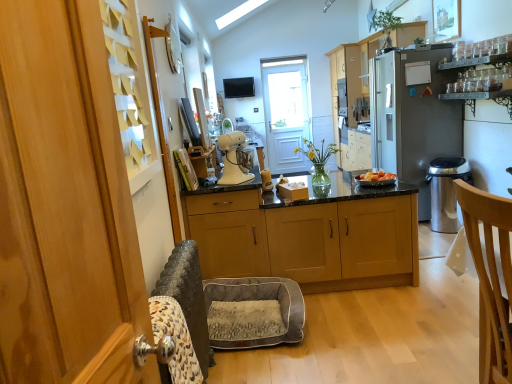
This screenshot has height=384, width=512. I want to click on light wood cabinets at center, the second cabinetry ordered from the bottom, so click(x=350, y=105).

Identify the location of green leafy plant at upper center, the 2th houseplant in the front-to-back sequence. The height and width of the screenshot is (384, 512). (386, 25).

In the scene shown: What is the approximate width of light brown wooden chair at right?

light brown wooden chair at right is 12.27 inches in width.

In order to face translucent glass vase at center, the first houseplant in the bottom-to-top sequence, should I rotate leftwards or rightwards?

You should rotate right by 8.655 degrees.

The image size is (512, 384). I want to click on light wood cabinets at center, the second cabinetry ordered from the bottom, so click(x=350, y=105).

Do you think light brown wooden chair at right is within satin silver trash can at right, or outside of it?

light brown wooden chair at right is spatially situated outside satin silver trash can at right.

Considering the points (488, 218) and (459, 166), which point is behind, point (488, 218) or point (459, 166)?

Point (459, 166)

Considering the sizes of objects translucent glass vase at center, arranged as the second houseplant when viewed from the top, and green leafy plant at upper center, which is the first houseplant in right-to-left order, in the image provided, who is bigger, translucent glass vase at center, arranged as the second houseplant when viewed from the top, or green leafy plant at upper center, which is the first houseplant in right-to-left order,?

With larger size is green leafy plant at upper center, which is the first houseplant in right-to-left order.

Is translucent glass vase at center, positioned as the second houseplant in back-to-front order, inside the boundaries of green leafy plant at upper center, arranged as the second houseplant when ordered from the bottom, or outside?

translucent glass vase at center, positioned as the second houseplant in back-to-front order, lies outside green leafy plant at upper center, arranged as the second houseplant when ordered from the bottom.

In the scene shown: From the image's perspective, which one is positioned lower, translucent glass vase at center, which is the 1th houseplant in front-to-back order, or green leafy plant at upper center, the second houseplant viewed from the left?

translucent glass vase at center, which is the 1th houseplant in front-to-back order, from the image's perspective.

Does green leafy plant at upper center, the 2th houseplant in the front-to-back sequence, have a greater height compared to satin silver trash can at right?

No, green leafy plant at upper center, the 2th houseplant in the front-to-back sequence, is not taller than satin silver trash can at right.

Which is more to the right, green leafy plant at upper center, which is the first houseplant in right-to-left order, or satin silver trash can at right?

satin silver trash can at right is more to the right.

Considering the positions of point (384, 16) and point (445, 228), is point (384, 16) closer or farther from the camera than point (445, 228)?

Point (384, 16) is farther from the camera than point (445, 228).

Which object is wider, green leafy plant at upper center, arranged as the second houseplant when ordered from the bottom, or translucent glass vase at center, arranged as the first houseplant when viewed from the left?

green leafy plant at upper center, arranged as the second houseplant when ordered from the bottom.

Can you confirm if green leafy plant at upper center, the first houseplant when ordered from back to front, is bigger than translucent glass vase at center, arranged as the first houseplant when viewed from the left?

Yes.

From the image's perspective, which object appears higher, green leafy plant at upper center, the first houseplant positioned from the top, or translucent glass vase at center, arranged as the first houseplant when viewed from the left?

green leafy plant at upper center, the first houseplant positioned from the top, appears higher in the image.

From the image's perspective, who appears lower, wooden cabinets at center, the first cabinetry in the bottom-to-top sequence, or white wooden screen door at center?

wooden cabinets at center, the first cabinetry in the bottom-to-top sequence, appears lower in the image.

Can you confirm if wooden cabinets at center, which appears as the 1th cabinetry when viewed from the front, is thinner than white wooden screen door at center?

Incorrect, the width of wooden cabinets at center, which appears as the 1th cabinetry when viewed from the front, is not less than that of white wooden screen door at center.

Can you confirm if wooden cabinets at center, the 2th cabinetry in the right-to-left sequence, is shorter than white wooden screen door at center?

Indeed, wooden cabinets at center, the 2th cabinetry in the right-to-left sequence, has a lesser height compared to white wooden screen door at center.

Does wooden cabinets at center, which appears as the 1th cabinetry when viewed from the front, have a larger size compared to white wooden screen door at center?

Indeed, wooden cabinets at center, which appears as the 1th cabinetry when viewed from the front, has a larger size compared to white wooden screen door at center.

This screenshot has width=512, height=384. In order to click on houseplant above the light wood cabinets at center, which is the 1th cabinetry from top to bottom (from the image's perspective) in this screenshot , I will do `click(386, 25)`.

In the image, is green leafy plant at upper center, the first houseplant when ordered from back to front, positioned in front of or behind light wood cabinets at center, the second cabinetry ordered from the bottom?

Clearly, green leafy plant at upper center, the first houseplant when ordered from back to front, is in front of light wood cabinets at center, the second cabinetry ordered from the bottom.

In terms of width, does green leafy plant at upper center, the second houseplant viewed from the left, look wider or thinner when compared to light wood cabinets at center, which appears as the first cabinetry when viewed from the right?

Clearly, green leafy plant at upper center, the second houseplant viewed from the left, has less width compared to light wood cabinets at center, which appears as the first cabinetry when viewed from the right.

Does green leafy plant at upper center, arranged as the second houseplant when ordered from the bottom, have a larger size compared to light wood cabinets at center, the 1th cabinetry viewed from the back?

Actually, green leafy plant at upper center, arranged as the second houseplant when ordered from the bottom, might be smaller than light wood cabinets at center, the 1th cabinetry viewed from the back.

Which is behind, point (195, 135) or point (248, 81)?

The point (248, 81) is more distant.

From the image's perspective, who appears lower, satin black oven at upper center or matte black tv at upper center?

satin black oven at upper center appears lower in the image.

Considering the sizes of objects satin black oven at upper center and matte black tv at upper center in the image provided, who is thinner, satin black oven at upper center or matte black tv at upper center?

satin black oven at upper center is thinner.

Is the depth of satin black oven at upper center greater than that of matte black tv at upper center?

That is False.

The height and width of the screenshot is (384, 512). I want to click on trash bin/can behind the light brown wooden chair at right, so click(446, 191).

Find the location of a particular element. The height and width of the screenshot is (384, 512). houseplant lying on the left of green leafy plant at upper center, the 2th houseplant in the front-to-back sequence is located at coordinates (318, 160).

Considering their positions, is white wooden screen door at center positioned further to white glossy stand mixer at center than green leafy plant at upper center, the first houseplant positioned from the top?

Based on the image, white wooden screen door at center appears to be further to white glossy stand mixer at center.

From the image, which object appears to be farther from light wood cabinets at center, which is the 1th cabinetry from top to bottom, white wooden screen door at center or green leafy plant at upper center, arranged as the second houseplant when ordered from the bottom?

The object further to light wood cabinets at center, which is the 1th cabinetry from top to bottom, is green leafy plant at upper center, arranged as the second houseplant when ordered from the bottom.

Based on their spatial positions, is light wood cabinets at center, which appears as the first cabinetry when viewed from the right, or satin silver refrigerator at right closer to white glossy stand mixer at center?

The object closer to white glossy stand mixer at center is satin silver refrigerator at right.

From the image, which object appears to be nearer to light wood cabinets at center, which is the 1th cabinetry from top to bottom, translucent glass vase at center, arranged as the second houseplant when viewed from the top, or light brown wooden chair at right?

translucent glass vase at center, arranged as the second houseplant when viewed from the top, is positioned closer to the anchor light wood cabinets at center, which is the 1th cabinetry from top to bottom.

Based on their spatial positions, is matte black tv at upper center or white wooden screen door at center closer to green leafy plant at upper center, the first houseplant when ordered from back to front?

white wooden screen door at center is closer to green leafy plant at upper center, the first houseplant when ordered from back to front.

From the image, which object appears to be farther from satin black oven at upper center, satin silver refrigerator at right or white glossy stand mixer at center?

satin silver refrigerator at right is further to satin black oven at upper center.

Considering their positions, is satin silver refrigerator at right positioned further to satin silver trash can at right than light brown wooden chair at right?

light brown wooden chair at right.

Consider the image. Estimate the real-world distances between objects in this image. Which object is further from matte black tv at upper center, light brown wooden chair at right or white glossy stand mixer at center?

light brown wooden chair at right is further to matte black tv at upper center.

At what (x,y) coordinates should I click in order to perform the action: click on refrigerator between satin black oven at upper center and matte black tv at upper center along the z-axis. Please return your answer as a coordinate pair (x, y). This screenshot has width=512, height=384. Looking at the image, I should click on coord(413,115).

You are a GUI agent. You are given a task and a screenshot of the screen. Output one action in this format:
    pyautogui.click(x=<x>, y=<y>)
    Task: Click on the refrigerator located between wooden cabinets at center, the first cabinetry in the bottom-to-top sequence, and satin silver trash can at right in the left-right direction
    
    Given the screenshot: What is the action you would take?
    pyautogui.click(x=413, y=115)

Image resolution: width=512 pixels, height=384 pixels. I want to click on kitchen appliance between light brown wooden chair at right and matte black tv at upper center in the front-back direction, so click(x=232, y=159).

You are a GUI agent. You are given a task and a screenshot of the screen. Output one action in this format:
    pyautogui.click(x=<x>, y=<y>)
    Task: Click on the oven between white glossy stand mixer at center and matte black tv at upper center in the front-back direction
    
    Given the screenshot: What is the action you would take?
    pyautogui.click(x=190, y=122)